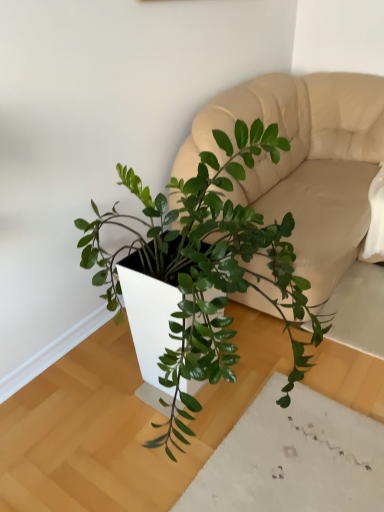
What is the approximate height of beige leather couch at center?

The height of beige leather couch at center is 92.52 centimeters.

The width and height of the screenshot is (384, 512). What do you see at coordinates (305, 162) in the screenshot? I see `beige leather couch at center` at bounding box center [305, 162].

Locate an element on the screen. The height and width of the screenshot is (512, 384). beige leather couch at center is located at coordinates (305, 162).

What do you see at coordinates (206, 268) in the screenshot?
I see `green glossy plant at center` at bounding box center [206, 268].

Locate an element on the screen. green glossy plant at center is located at coordinates (206, 268).

Find the location of `beige leather couch at center`. beige leather couch at center is located at coordinates (305, 162).

Is green glossy plant at center at the right side of beige leather couch at center?

Incorrect, green glossy plant at center is not on the right side of beige leather couch at center.

Considering the positions of objects green glossy plant at center and beige leather couch at center in the image provided, who is in front, green glossy plant at center or beige leather couch at center?

green glossy plant at center is more forward.

Which is closer, [195,260] or [264,158]?

Point [195,260] appears to be closer to the viewer than point [264,158].

From the image's perspective, is green glossy plant at center on top of beige leather couch at center?

No, from the image's perspective, green glossy plant at center is not on top of beige leather couch at center.

Based on the photo, from a real-world perspective, who is located lower, green glossy plant at center or beige leather couch at center?

beige leather couch at center is physically lower.

Looking at their sizes, would you say green glossy plant at center is wider or thinner than beige leather couch at center?

Clearly, green glossy plant at center has less width compared to beige leather couch at center.

Who is shorter, green glossy plant at center or beige leather couch at center?

Standing shorter between the two is beige leather couch at center.

Considering the relative sizes of green glossy plant at center and beige leather couch at center in the image provided, is green glossy plant at center smaller than beige leather couch at center?

Correct, green glossy plant at center occupies less space than beige leather couch at center.

Would you say green glossy plant at center is inside or outside beige leather couch at center?

green glossy plant at center is not inside beige leather couch at center, it's outside.

Is green glossy plant at center not close to beige leather couch at center?

No, there isn't a large distance between green glossy plant at center and beige leather couch at center.

Could you tell me if green glossy plant at center is turned towards beige leather couch at center?

No, green glossy plant at center is not turned towards beige leather couch at center.

Can you tell me how much green glossy plant at center and beige leather couch at center differ in facing direction?

The facing directions of green glossy plant at center and beige leather couch at center are 90.3 degrees apart.

This screenshot has width=384, height=512. In order to click on houseplant that appears above the beige leather couch at center (from a real-world perspective) in this screenshot , I will do `click(206, 268)`.

Is beige leather couch at center at the right side of green glossy plant at center?

Indeed, beige leather couch at center is positioned on the right side of green glossy plant at center.

Which object is further away from the camera, beige leather couch at center or green glossy plant at center?

beige leather couch at center is behind.

Does point (348, 323) appear closer or farther from the camera than point (204, 257)?

Point (348, 323) appears to be farther away from the viewer than point (204, 257).

From the image's perspective, is beige leather couch at center over green glossy plant at center?

Correct, beige leather couch at center appears higher than green glossy plant at center in the image.

From a real-world perspective, between beige leather couch at center and green glossy plant at center, who is vertically lower?

beige leather couch at center, from a real-world perspective.

Considering the relative sizes of beige leather couch at center and green glossy plant at center in the image provided, is beige leather couch at center wider than green glossy plant at center?

Correct, the width of beige leather couch at center exceeds that of green glossy plant at center.

Considering the sizes of objects beige leather couch at center and green glossy plant at center in the image provided, who is shorter, beige leather couch at center or green glossy plant at center?

beige leather couch at center.

Is beige leather couch at center smaller than green glossy plant at center?

Actually, beige leather couch at center might be larger than green glossy plant at center.

Is beige leather couch at center inside or outside of green glossy plant at center?

beige leather couch at center exists outside the volume of green glossy plant at center.

Is beige leather couch at center in contact with green glossy plant at center?

They are not placed beside each other.

Is beige leather couch at center aimed at green glossy plant at center?

Yes.

What's the angular difference between beige leather couch at center and green glossy plant at center's facing directions?

The angular difference between beige leather couch at center and green glossy plant at center is 90.3 degrees.

Find the location of a particular element. The width and height of the screenshot is (384, 512). houseplant on the left side of beige leather couch at center is located at coordinates (206, 268).

This screenshot has width=384, height=512. I want to click on houseplant on the left of beige leather couch at center, so click(x=206, y=268).

The height and width of the screenshot is (512, 384). Identify the location of couch lying above the green glossy plant at center (from the image's perspective). (305, 162).